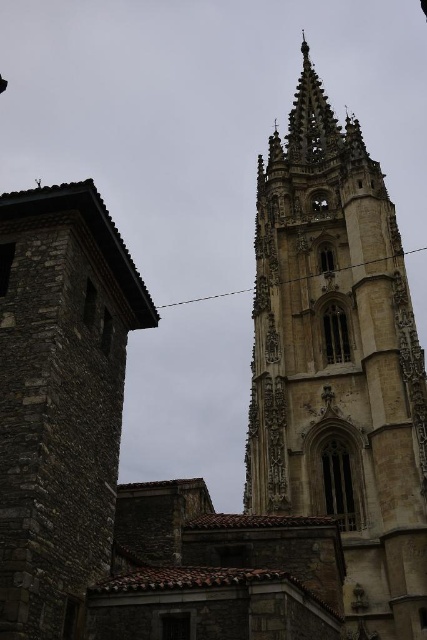
Is brown stone tower at upper right below stone tower at left?

No.

Is point (332, 506) more distant than point (5, 481)?

That is True.

The height and width of the screenshot is (640, 427). What do you see at coordinates (339, 364) in the screenshot? I see `brown stone tower at upper right` at bounding box center [339, 364].

You are a GUI agent. You are given a task and a screenshot of the screen. Output one action in this format:
    pyautogui.click(x=<x>, y=<y>)
    Task: Click on the brown stone tower at upper right
    
    Given the screenshot: What is the action you would take?
    pyautogui.click(x=339, y=364)